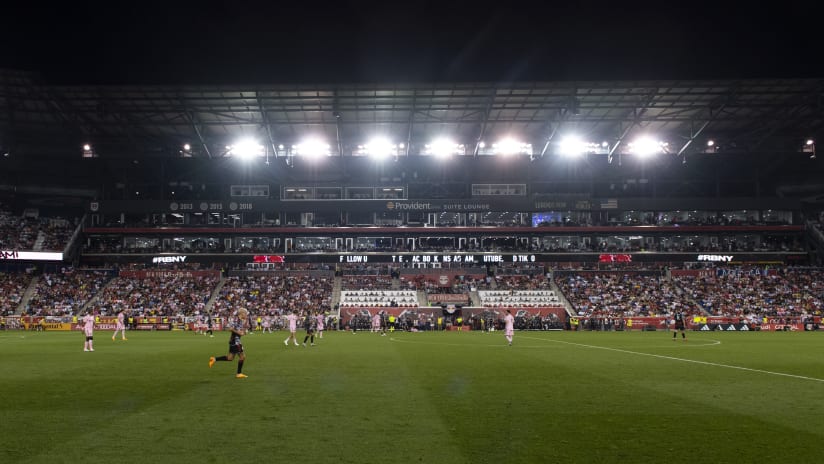
In order to click on light in this screenshot , I will do `click(506, 146)`.